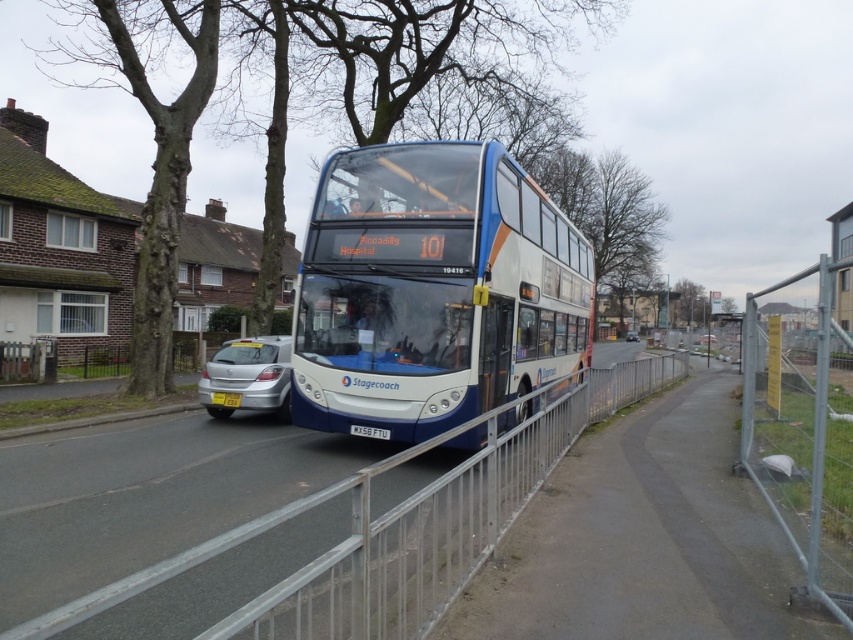
Can you confirm if metal fence at right is positioned to the left of brown rough tree at upper left?

No, metal fence at right is not to the left of brown rough tree at upper left.

Is metal fence at right taller than brown rough tree at upper left?

Incorrect, metal fence at right's height is not larger of brown rough tree at upper left's.

Measure the distance between point [822,388] and camera.

The distance of point [822,388] from camera is 4.09 meters.

Find the location of a particular element. The width and height of the screenshot is (853, 640). metal fence at right is located at coordinates (804, 436).

Which is behind, point (134, 392) or point (225, 413)?

The point (134, 392) is more distant.

Does brown bark tree at upper center appear under silver metallic sedan at lower left?

Incorrect, brown bark tree at upper center is not positioned below silver metallic sedan at lower left.

Is point (167, 93) farther from camera compared to point (260, 378)?

That is True.

Image resolution: width=853 pixels, height=640 pixels. Find the location of `brown bark tree at upper center`. brown bark tree at upper center is located at coordinates (300, 65).

Can you confirm if green leafy tree at upper center is positioned below yellow matte license plate at center?

Actually, green leafy tree at upper center is above yellow matte license plate at center.

Between point (700, 292) and point (223, 394), which one is positioned behind?

The point (700, 292) is more distant.

Between point (697, 301) and point (223, 403), which one is positioned in front?

Point (223, 403) is more forward.

Find the location of a particular element. This screenshot has height=640, width=853. green leafy tree at upper center is located at coordinates (689, 301).